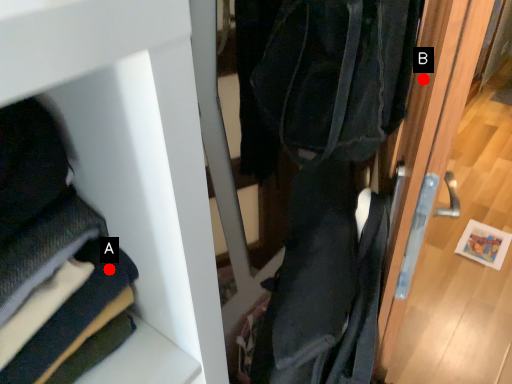
Question: Two points are circled on the image, labeled by A and B beside each circle. Among these points, which one is nearest to the camera?

Choices:
 (A) A is closer
 (B) B is closer

Answer: (A)